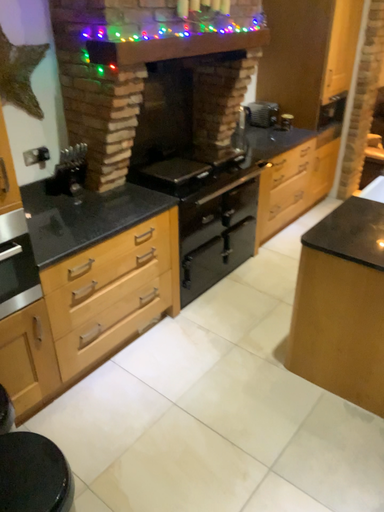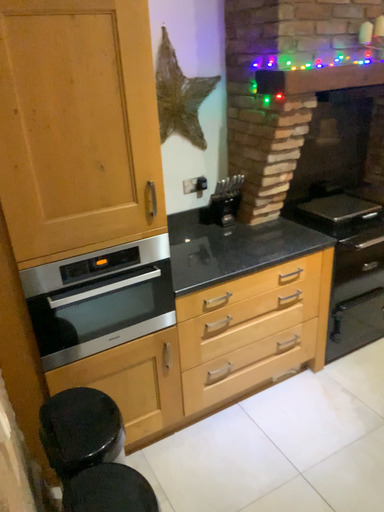
Question: How did the camera likely rotate when shooting the video?

Choices:
 (A) rotated downward
 (B) rotated upward

Answer: (B)